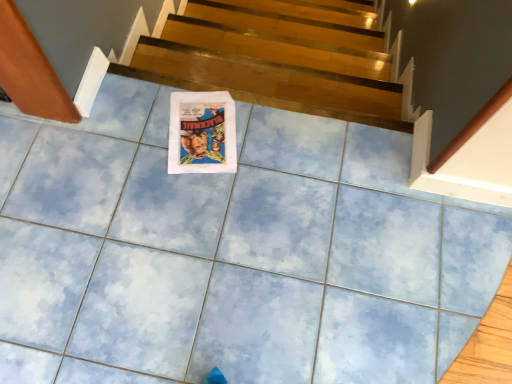
This screenshot has width=512, height=384. In order to click on free space above wooden at upper center (from a real-world perspective) in this screenshot , I will do `click(251, 78)`.